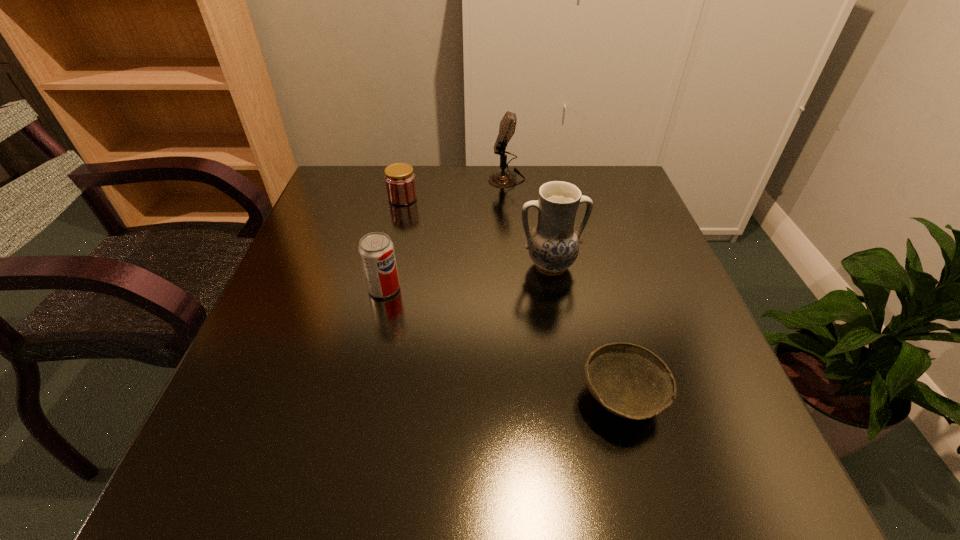
You are a GUI agent. You are given a task and a screenshot of the screen. Output one action in this format:
    pyautogui.click(x=<x>, y=<y>)
    Task: Click on the vacant point located 0.180m on the right of the pottery
    Image resolution: width=960 pixels, height=540 pixels.
    Given the screenshot: What is the action you would take?
    pyautogui.click(x=664, y=265)

I want to click on vacant position located 0.230m on the front of the soda, so click(359, 400).

Find the location of `blank area located 0.260m on the right of the second farthest object`. blank area located 0.260m on the right of the second farthest object is located at coordinates (515, 198).

You are a GUI agent. You are given a task and a screenshot of the screen. Output one action in this format:
    pyautogui.click(x=<x>, y=<y>)
    Task: Click on the vacant space situated on the left of the shortest object
    
    Given the screenshot: What is the action you would take?
    pyautogui.click(x=494, y=399)

Identify the location of microphone that is at the far edge. (502, 179).

Find the location of `jam that is at the far edge`. jam that is at the far edge is located at coordinates (400, 183).

This screenshot has width=960, height=540. I want to click on object at the right edge, so click(630, 381).

In the image, there is a desktop. Where is `vacant space at the far edge`? This screenshot has width=960, height=540. vacant space at the far edge is located at coordinates (485, 186).

In the image, there is a desktop. Where is `vacant area at the left edge`? vacant area at the left edge is located at coordinates (347, 291).

Where is `vacant region at the right edge of the desktop`? Image resolution: width=960 pixels, height=540 pixels. vacant region at the right edge of the desktop is located at coordinates (609, 261).